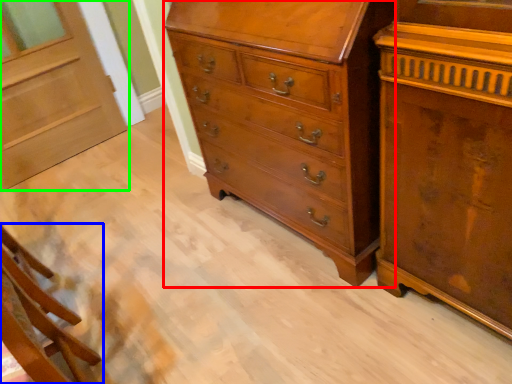
Question: Based on their relative distances, which object is farther from chest of drawers (highlighted by a red box)? Choose from furniture (highlighted by a blue box) and door (highlighted by a green box).

Choices:
 (A) furniture
 (B) door

Answer: (B)